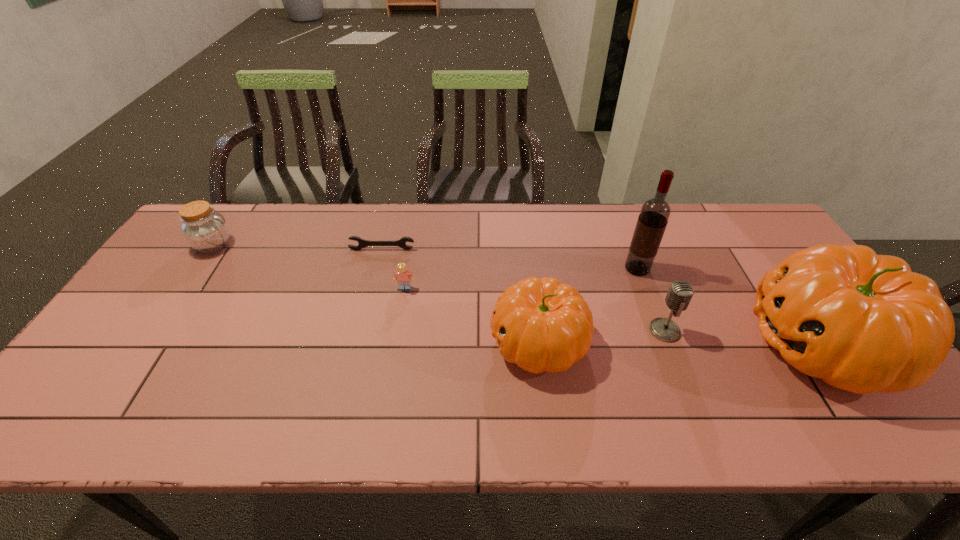
This screenshot has width=960, height=540. What are the coordinates of `the left pumpkin` in the screenshot? It's located at (540, 325).

At what (x,y) coordinates should I click in order to perform the action: click on the fourth object from right to left. Please return your answer as a coordinate pair (x, y). Looking at the image, I should click on (540, 325).

I want to click on the rightmost object, so click(864, 323).

The image size is (960, 540). Find the location of `the taller pumpkin`. the taller pumpkin is located at coordinates (864, 323).

You are a GUI agent. You are given a task and a screenshot of the screen. Output one action in this format:
    pyautogui.click(x=<x>, y=<y>)
    Task: Click on the jar
    The height and width of the screenshot is (540, 960).
    Given the screenshot: What is the action you would take?
    pyautogui.click(x=204, y=229)

Locate an element on the screen. the leftmost object is located at coordinates (204, 229).

Locate an element on the screen. wine bottle is located at coordinates click(655, 212).

Identify the location of the tallest object. This screenshot has width=960, height=540. (655, 212).

Locate an element on the screen. the second shortest object is located at coordinates (402, 276).

You are a GUI agent. You are given a task and a screenshot of the screen. Output one action in this format:
    pyautogui.click(x=<x>, y=<y>)
    Task: Click on the shortest object
    The height and width of the screenshot is (540, 960).
    Given the screenshot: What is the action you would take?
    pyautogui.click(x=362, y=243)